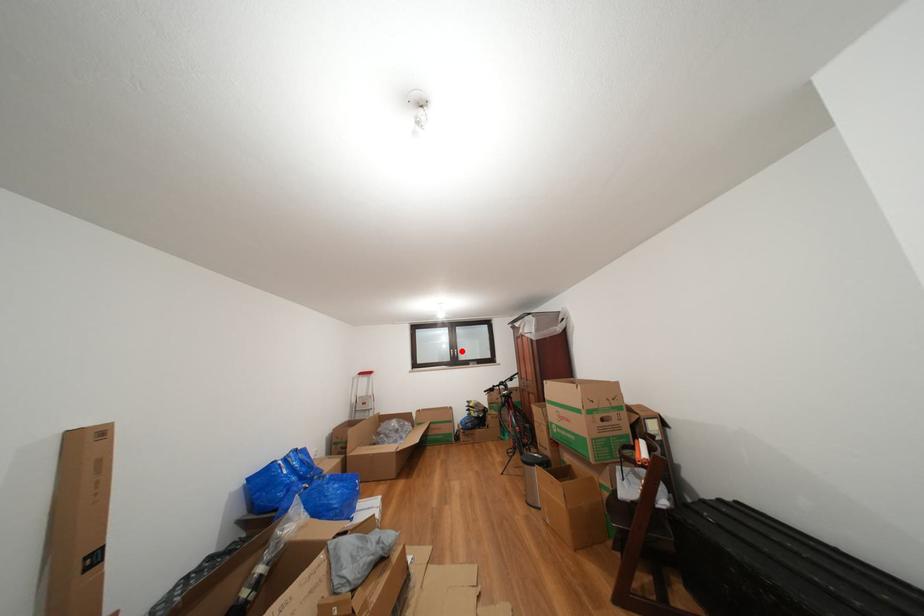
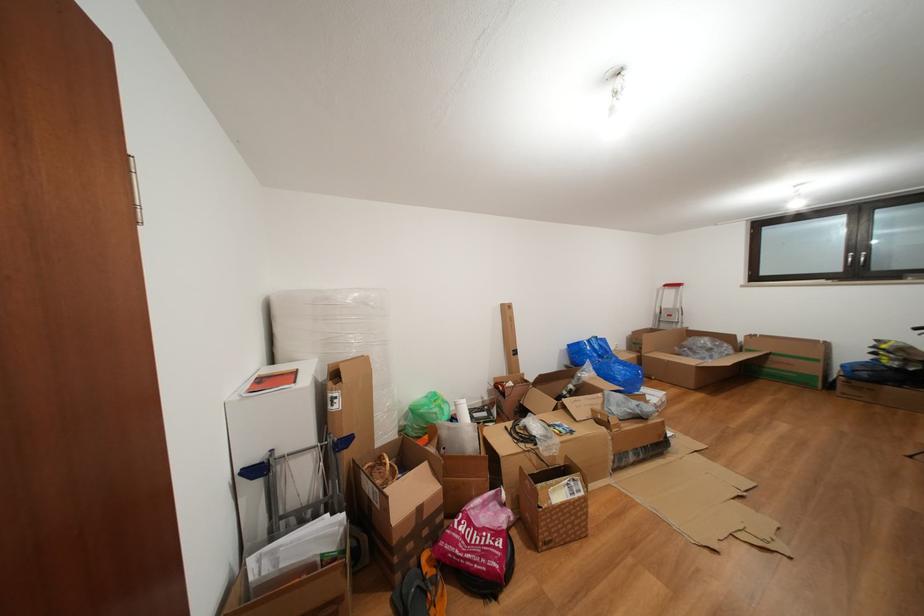
Find the pixel in the second image that matches the highlighted location in the first image.

(866, 252)